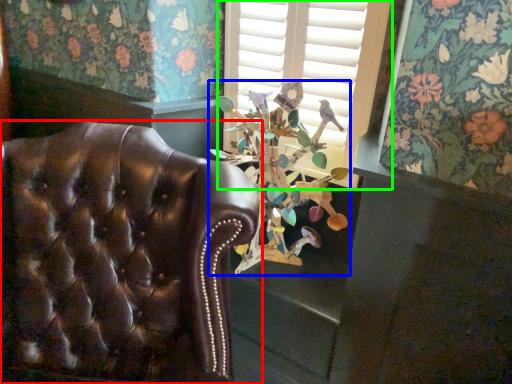
Question: Based on their relative distances, which object is farther from chair (highlighted by a red box)? Choose from floral arrangement (highlighted by a blue box) and window (highlighted by a green box).

Choices:
 (A) floral arrangement
 (B) window

Answer: (B)